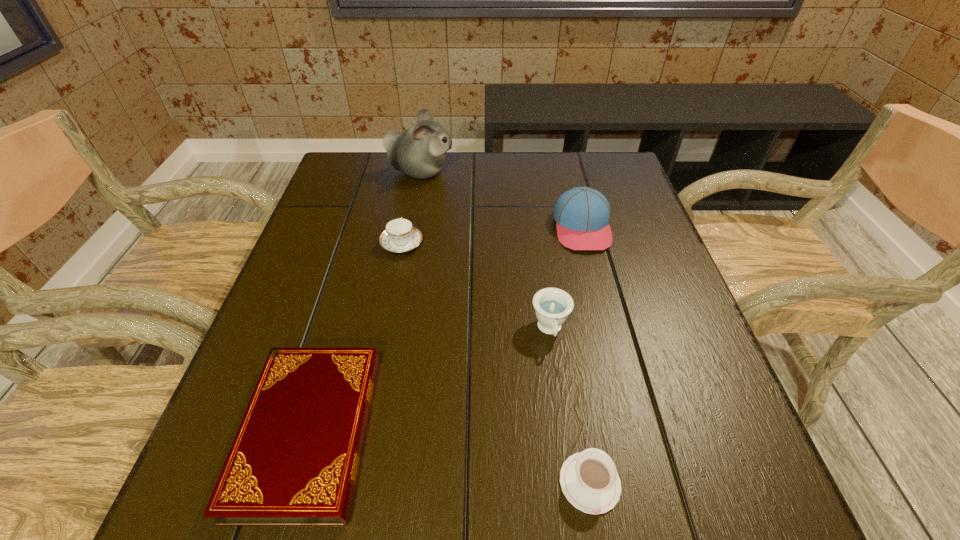
Locate an element on the screen. Image resolution: width=960 pixels, height=540 pixels. hamster that is at the left edge is located at coordinates pos(420,152).

Identify the location of hardback book that is at the left edge. The width and height of the screenshot is (960, 540). (x=294, y=461).

Identify the location of object that is at the right edge. (582, 214).

Image resolution: width=960 pixels, height=540 pixels. Identify the location of object present at the far left corner. (420, 152).

The image size is (960, 540). I want to click on object that is at the near left corner, so click(294, 461).

You are a GUI agent. You are given a task and a screenshot of the screen. Output one action in this format:
    pyautogui.click(x=<x>, y=<y>)
    Task: Click on the vacant space at the far edge
    The width and height of the screenshot is (960, 540).
    Given the screenshot: What is the action you would take?
    pyautogui.click(x=478, y=177)

Where is `vacant space at the near edge of the desktop`? The width and height of the screenshot is (960, 540). vacant space at the near edge of the desktop is located at coordinates (488, 486).

Identify the location of vacant space at the left edge. This screenshot has height=540, width=960. [216, 438].

Locate an element on the screen. The width and height of the screenshot is (960, 540). vacant space at the right edge of the desktop is located at coordinates (627, 364).

In order to click on free space at the near left corner of the desktop in this screenshot , I will do `click(268, 534)`.